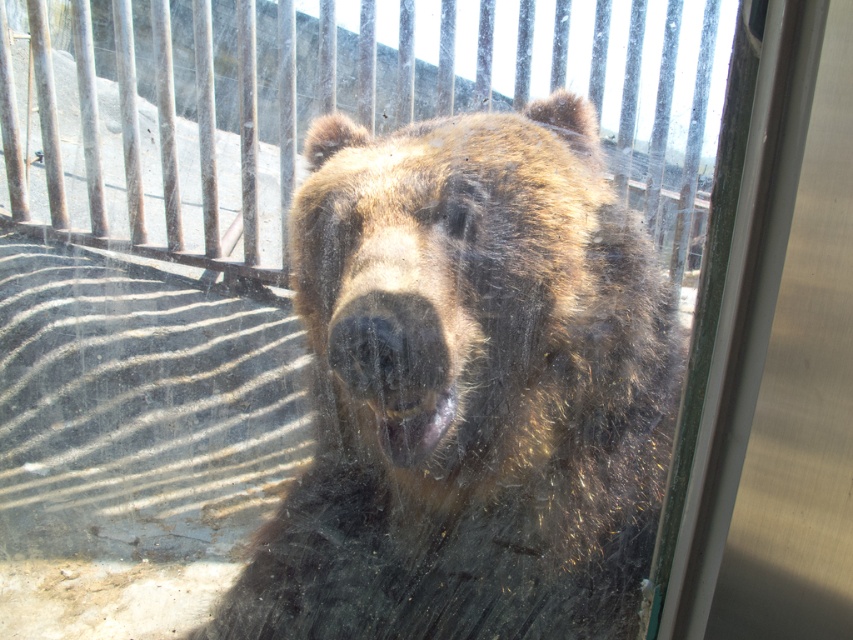
Does fuzzy brown bear at center have a lesser width compared to wooden at center?

Indeed, fuzzy brown bear at center has a lesser width compared to wooden at center.

The image size is (853, 640). Identify the location of fuzzy brown bear at center. (468, 388).